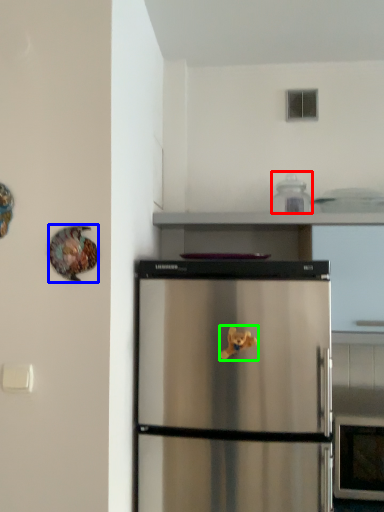
Question: Which object is positioned farthest from appliance (highlighted by a red box)? Select from animal (highlighted by a blue box) and toy (highlighted by a green box).

Choices:
 (A) animal
 (B) toy

Answer: (A)